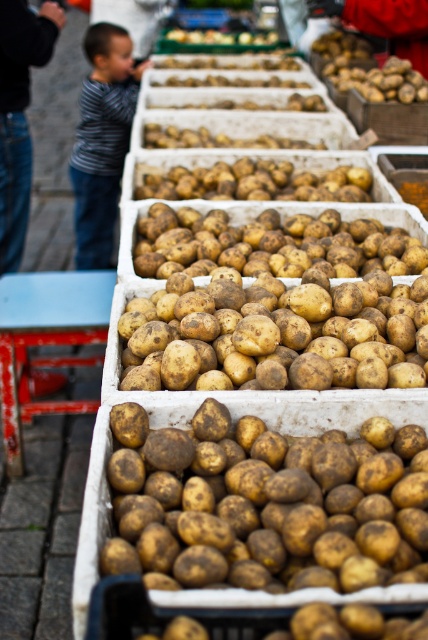
Question: From the image, what is the correct spatial relationship of brown rough potato at center in relation to rustic brown potato at center?

Choices:
 (A) right
 (B) left

Answer: (B)

Question: Which point appears closest to the camera in this image?

Choices:
 (A) tap(317, 369)
 (B) tap(104, 29)

Answer: (A)

Question: Does brown rough potato at center appear under brown matte potatoes at center?

Choices:
 (A) yes
 (B) no

Answer: (A)

Question: Is brown rough potato at center further to the viewer compared to striped shirt at left?

Choices:
 (A) no
 (B) yes

Answer: (A)

Question: Among these objects, which one is nearest to the camera?

Choices:
 (A) smooth blue table at center
 (B) brown matte potatoes at center
 (C) rustic brown potato at center

Answer: (B)

Question: Estimate the real-world distances between objects in this image. Which object is closer to the striped shirt at left?

Choices:
 (A) brown rough potato at center
 (B) smooth blue table at center

Answer: (B)